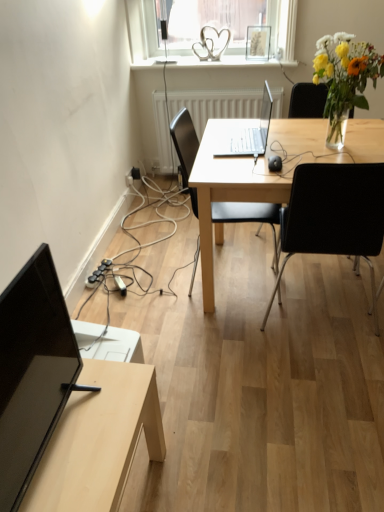
You are a GUI agent. You are given a task and a screenshot of the screen. Output one action in this format:
    pyautogui.click(x=<x>, y=<y>)
    Task: Click on the free location above light wood desk at center (from a real-world perspective)
    The height and width of the screenshot is (512, 384).
    Given the screenshot: What is the action you would take?
    pyautogui.click(x=313, y=141)